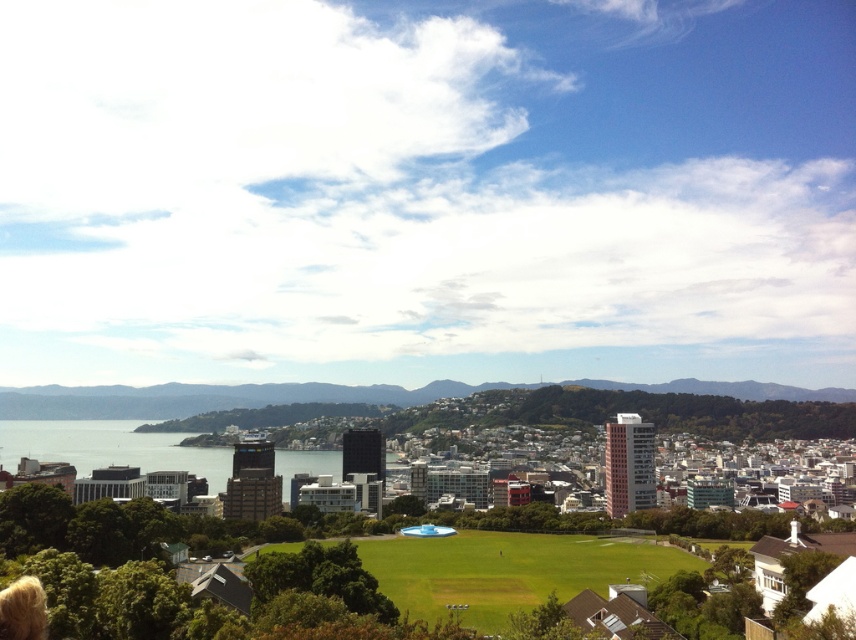
Between green grass field at center and transparent glass water at center, which one is positioned lower?

green grass field at center

Where is `green grass field at center`? The width and height of the screenshot is (856, 640). green grass field at center is located at coordinates (508, 570).

The height and width of the screenshot is (640, 856). What do you see at coordinates (508, 570) in the screenshot?
I see `green grass field at center` at bounding box center [508, 570].

The width and height of the screenshot is (856, 640). Find the location of `green grass field at center`. green grass field at center is located at coordinates (x=508, y=570).